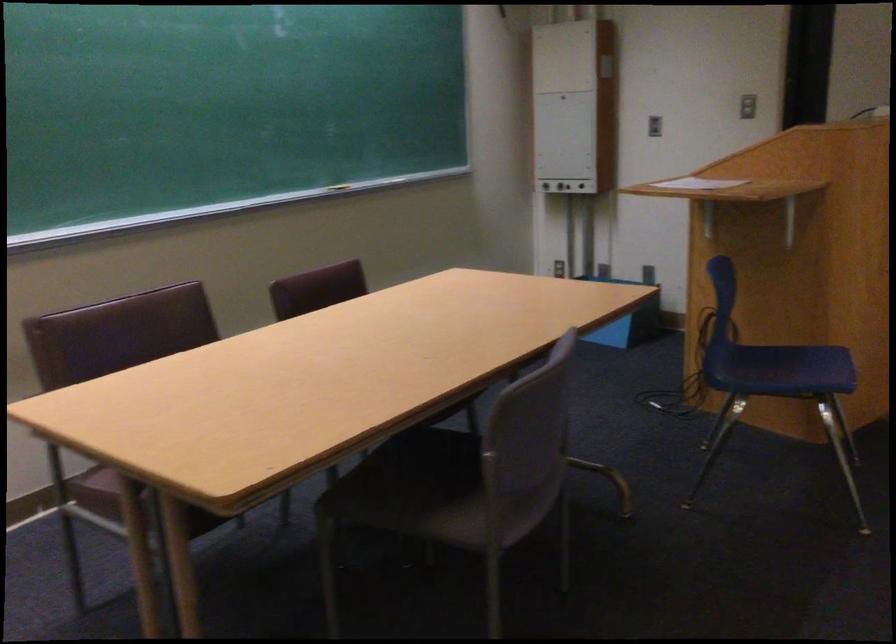
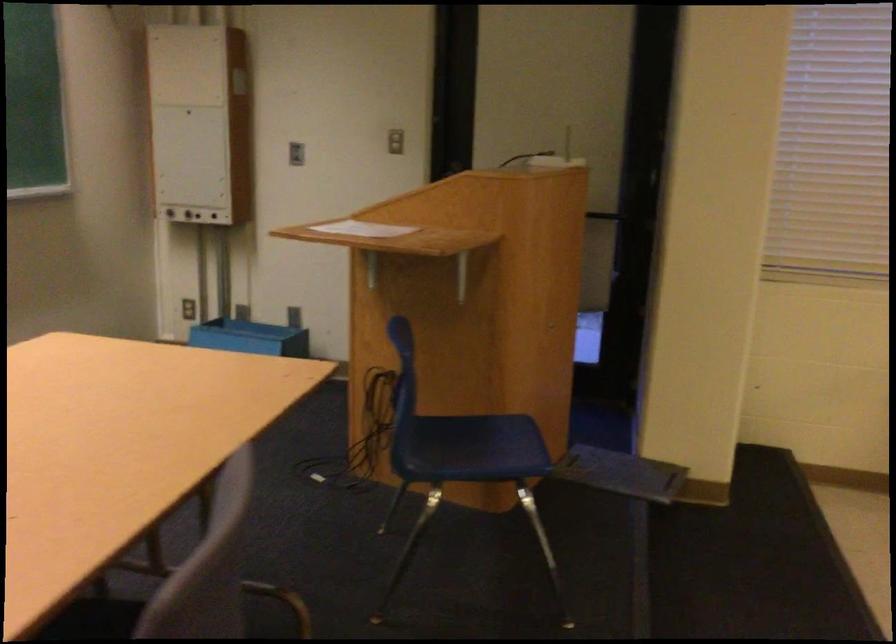
In the second image, find the point that corresponds to pixel 540 184 in the first image.

(167, 210)